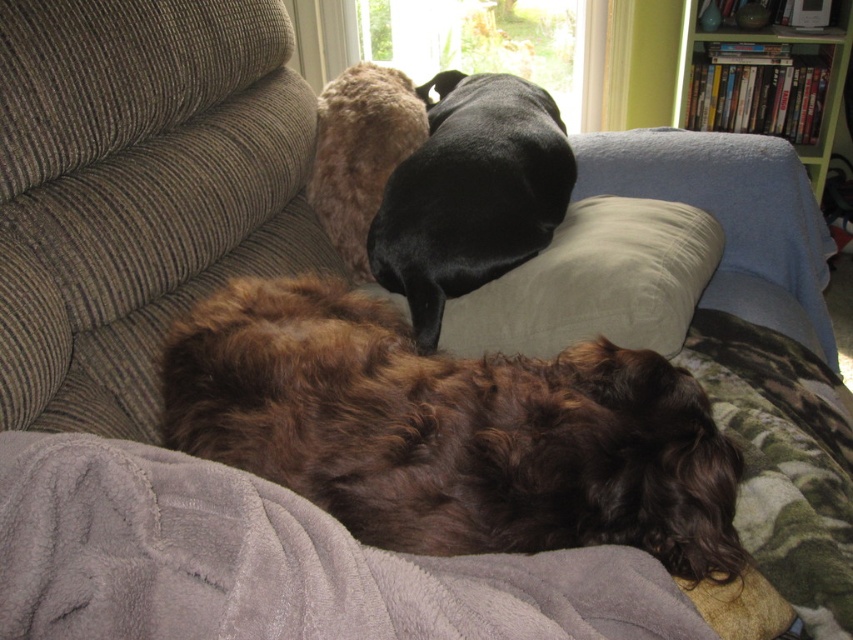
Can you confirm if brown fuzzy dog at lower center is wider than green wood bookshelf at upper right?

Yes.

Who is higher up, brown fuzzy dog at lower center or green wood bookshelf at upper right?

Positioned higher is green wood bookshelf at upper right.

Find the location of a particular element. The width and height of the screenshot is (853, 640). brown fuzzy dog at lower center is located at coordinates (451, 432).

This screenshot has width=853, height=640. Describe the element at coordinates (595, 282) in the screenshot. I see `satin beige pillow at center` at that location.

Can you confirm if satin beige pillow at center is positioned below green wood bookshelf at upper right?

Indeed, satin beige pillow at center is positioned under green wood bookshelf at upper right.

Where is `satin beige pillow at center`? satin beige pillow at center is located at coordinates (595, 282).

Is brown fuzzy dog at lower center thinner than gray fleece blanket at lower left?

No.

Is brown fuzzy dog at lower center shorter than gray fleece blanket at lower left?

No, brown fuzzy dog at lower center is not shorter than gray fleece blanket at lower left.

From the picture: Who is more distant from viewer, (672, 474) or (61, 449)?

The point (672, 474) is more distant.

Locate an element on the screen. brown fuzzy dog at lower center is located at coordinates (451, 432).